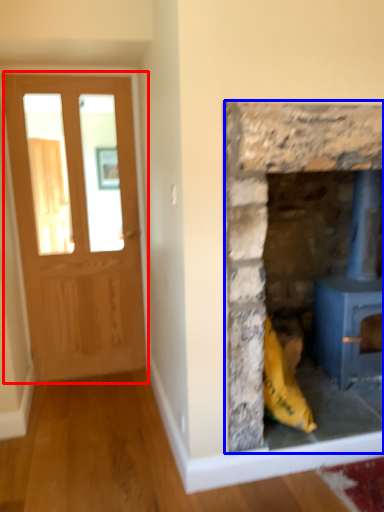
Question: Which of the following is the closest to the observer, glass door (highlighted by a red box) or fireplace (highlighted by a blue box)?

Choices:
 (A) glass door
 (B) fireplace

Answer: (B)